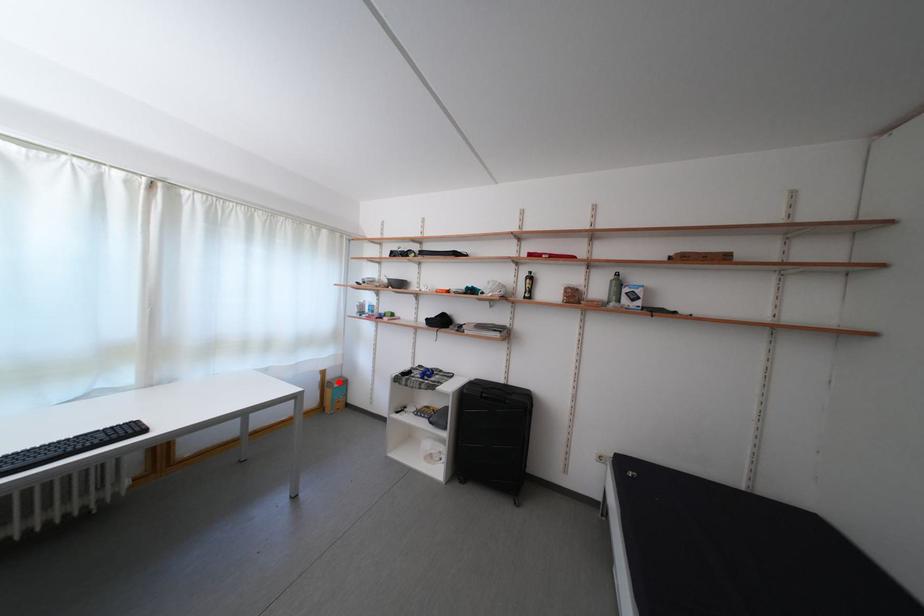
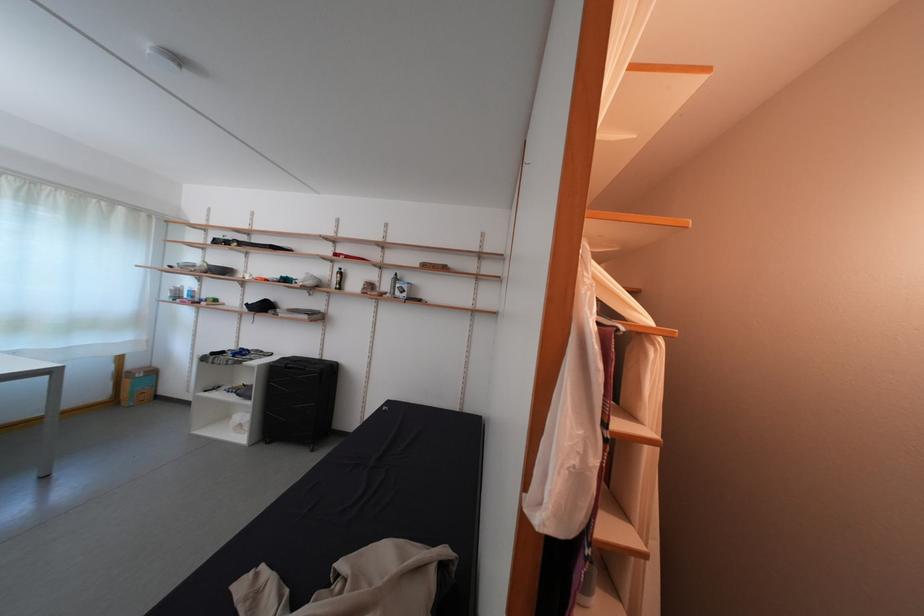
Question: I am providing you with two images of the same scene from different viewpoints. Given a red point in image1, look at the same physical point in image2. Is it:

Choices:
 (A) Closer to the viewpoint
 (B) Farther from the viewpoint

Answer: (A)